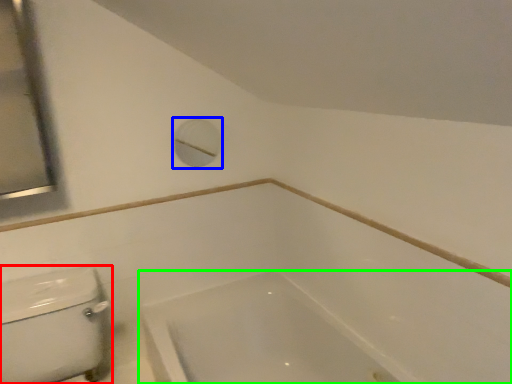
Question: Considering the real-world distances, which object is closest to porcelain (highlighted by a red box)? porthole (highlighted by a blue box) or bathtub (highlighted by a green box).

Choices:
 (A) porthole
 (B) bathtub

Answer: (B)